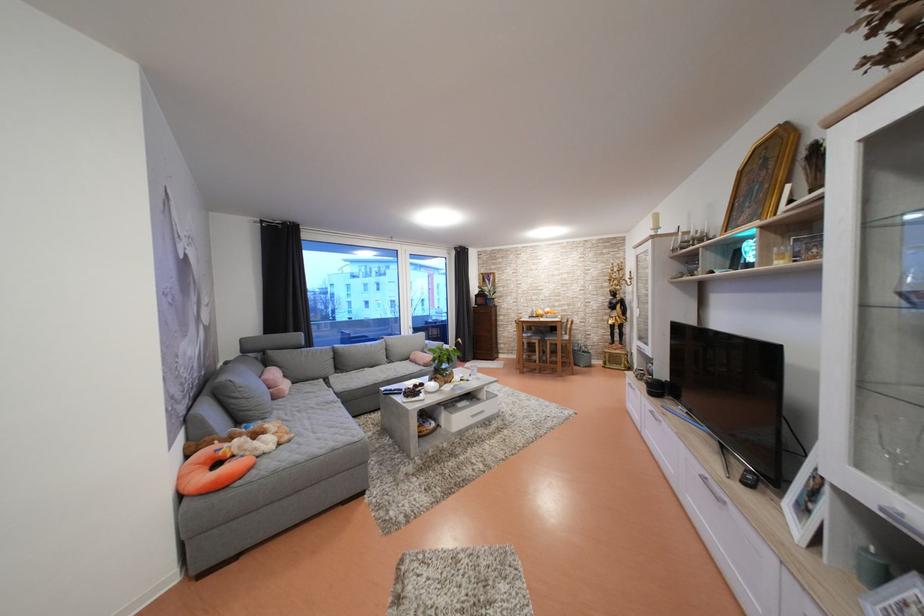
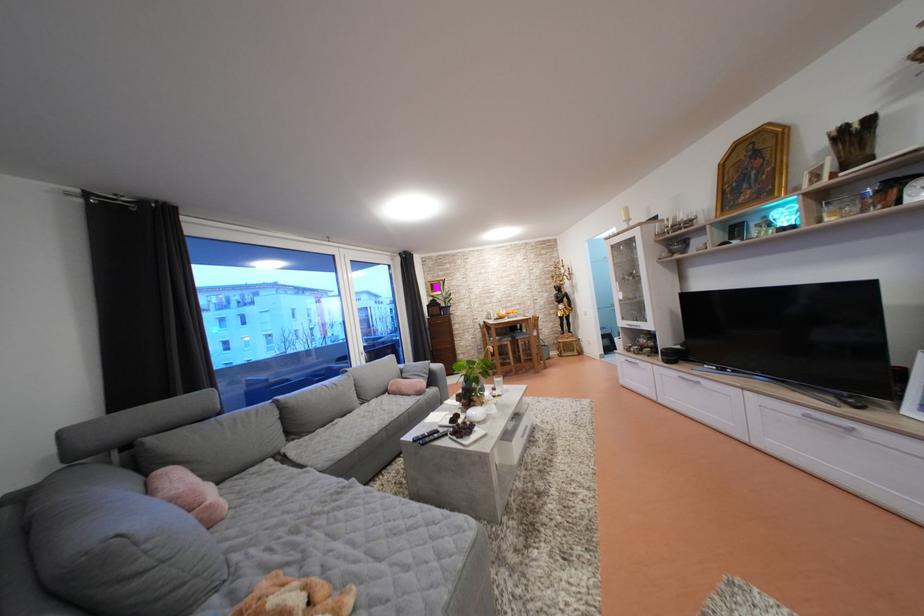
Locate, in the second image, the point that corresponds to (286,424) in the first image.

(274, 573)